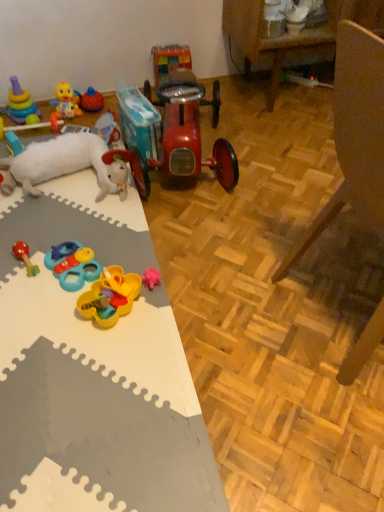
Question: Can you confirm if plastic/soft yellow and blue toy at lower left, the 4th toy viewed from the right, is bigger than multicolored plastic toy at center, which is the 2th toy from right to left?

Choices:
 (A) yes
 (B) no

Answer: (B)

Question: Does plastic/soft yellow and blue toy at lower left, the 4th toy viewed from the right, have a lesser height compared to multicolored plastic toy at center, which is the 2th toy from right to left?

Choices:
 (A) no
 (B) yes

Answer: (B)

Question: Considering the relative sizes of plastic/soft yellow and blue toy at lower left, the 8th toy positioned from the left, and multicolored plastic toy at center, which is the 2th toy from right to left, in the image provided, is plastic/soft yellow and blue toy at lower left, the 8th toy positioned from the left, taller than multicolored plastic toy at center, which is the 2th toy from right to left,?

Choices:
 (A) no
 (B) yes

Answer: (A)

Question: From a real-world perspective, is plastic/soft yellow and blue toy at lower left, the 4th toy viewed from the right, physically below multicolored plastic toy at center, acting as the tenth toy starting from the left?

Choices:
 (A) yes
 (B) no

Answer: (A)

Question: From a real-world perspective, is plastic/soft yellow and blue toy at lower left, the 8th toy positioned from the left, positioned over multicolored plastic toy at center, acting as the tenth toy starting from the left, based on gravity?

Choices:
 (A) yes
 (B) no

Answer: (B)

Question: From the image's perspective, relative to shiny red car at center, which is the first toy in right-to-left order, is plastic/soft yellow and blue toy at lower left, the 8th toy positioned from the left, above or below?

Choices:
 (A) below
 (B) above

Answer: (A)

Question: Choose the correct answer: Is plastic/soft yellow and blue toy at lower left, the 4th toy viewed from the right, inside shiny red car at center, which ranks as the 11th toy in left-to-right order, or outside it?

Choices:
 (A) inside
 (B) outside

Answer: (B)

Question: From a real-world perspective, is plastic/soft yellow and blue toy at lower left, the 8th toy positioned from the left, above or below shiny red car at center, which ranks as the 11th toy in left-to-right order?

Choices:
 (A) above
 (B) below

Answer: (B)

Question: Considering the positions of point (87, 275) and point (175, 106), is point (87, 275) closer or farther from the camera than point (175, 106)?

Choices:
 (A) closer
 (B) farther

Answer: (A)

Question: In the image, is plastic/soft yellow and blue toy at lower left, the 8th toy positioned from the left, positioned in front of or behind rubber duck at left, arranged as the second toy when viewed from the left?

Choices:
 (A) behind
 (B) front

Answer: (B)

Question: Considering the relative positions of plastic/soft yellow and blue toy at lower left, the 8th toy positioned from the left, and rubber duck at left, arranged as the second toy when viewed from the left, in the image provided, is plastic/soft yellow and blue toy at lower left, the 8th toy positioned from the left, to the left or to the right of rubber duck at left, arranged as the second toy when viewed from the left,?

Choices:
 (A) left
 (B) right

Answer: (B)

Question: Does point (59, 253) appear closer or farther from the camera than point (6, 138)?

Choices:
 (A) closer
 (B) farther

Answer: (A)

Question: From a real-world perspective, is plastic/soft yellow and blue toy at lower left, the 8th toy positioned from the left, positioned above or below rubber duck at left, marked as the tenth toy in a right-to-left arrangement?

Choices:
 (A) below
 (B) above

Answer: (A)

Question: From a real-world perspective, relative to rubber duck at left, arranged as the second toy when viewed from the left, is stacked plastic rings at upper left, the eleventh toy from the right, vertically above or below?

Choices:
 (A) below
 (B) above

Answer: (B)

Question: Is stacked plastic rings at upper left, the first toy when ordered from left to right, wider or thinner than rubber duck at left, arranged as the second toy when viewed from the left?

Choices:
 (A) thin
 (B) wide

Answer: (B)